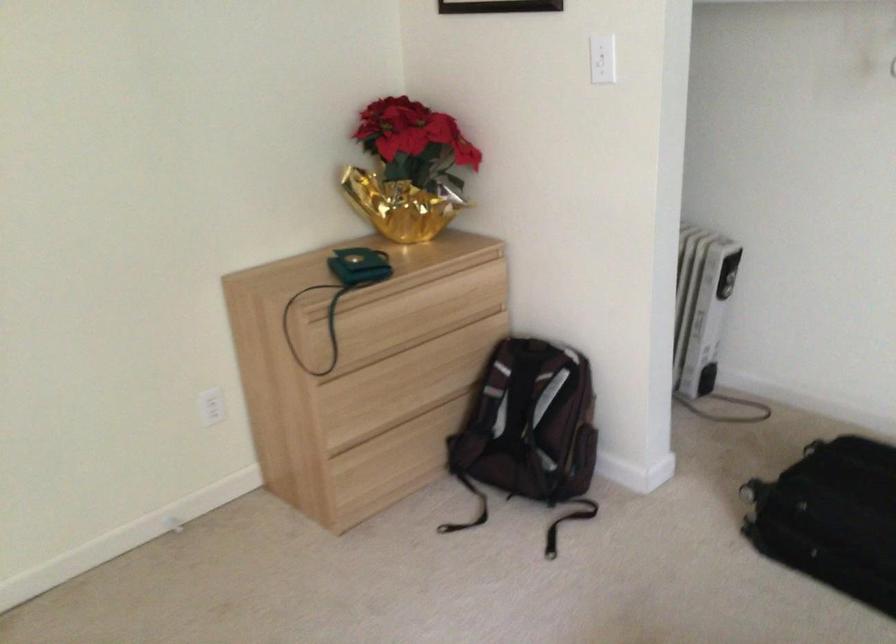
The image size is (896, 644). Describe the element at coordinates (358, 267) in the screenshot. I see `the small green purse` at that location.